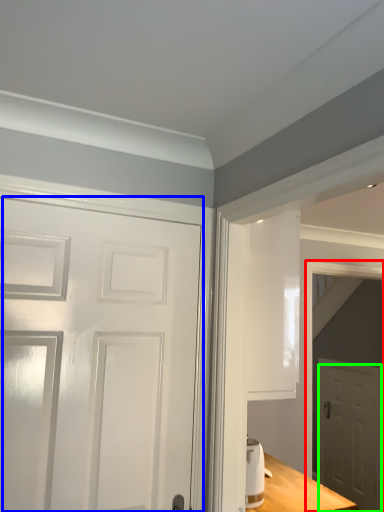
Question: Estimate the real-world distances between objects in this image. Which object is farther from elevator (highlighted by a red box), door (highlighted by a blue box) or door (highlighted by a green box)?

Choices:
 (A) door
 (B) door

Answer: (A)